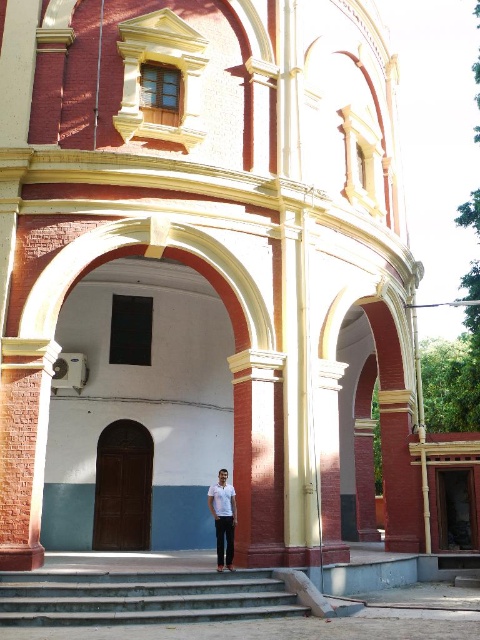
You are a delivery person carrying a white matte shirt at center and need to walk up the concrete stairs at center. Can you fit the shirt sideways without it hanging off the stairs?

The concrete stairs at center are wider than the white matte shirt at center, so yes, you can fit the shirt sideways without it hanging off the stairs.

You are standing at the entrance of the building and want to reach the main doorway. Where are the concrete stairs at center located?

The concrete stairs at center are located at point (142, 596).